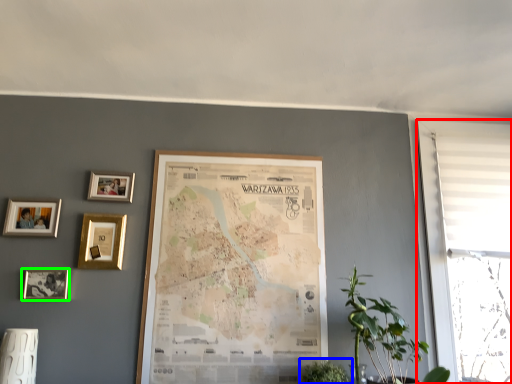
Question: Which object is positioned farthest from window (highlighted by a red box)? Select from houseplant (highlighted by a blue box) and picture frame (highlighted by a green box).

Choices:
 (A) houseplant
 (B) picture frame

Answer: (B)